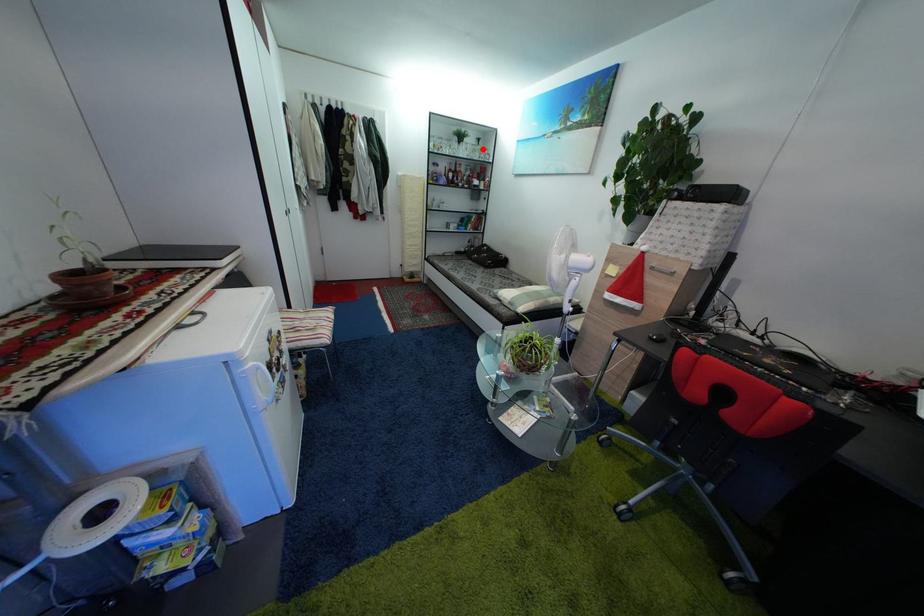
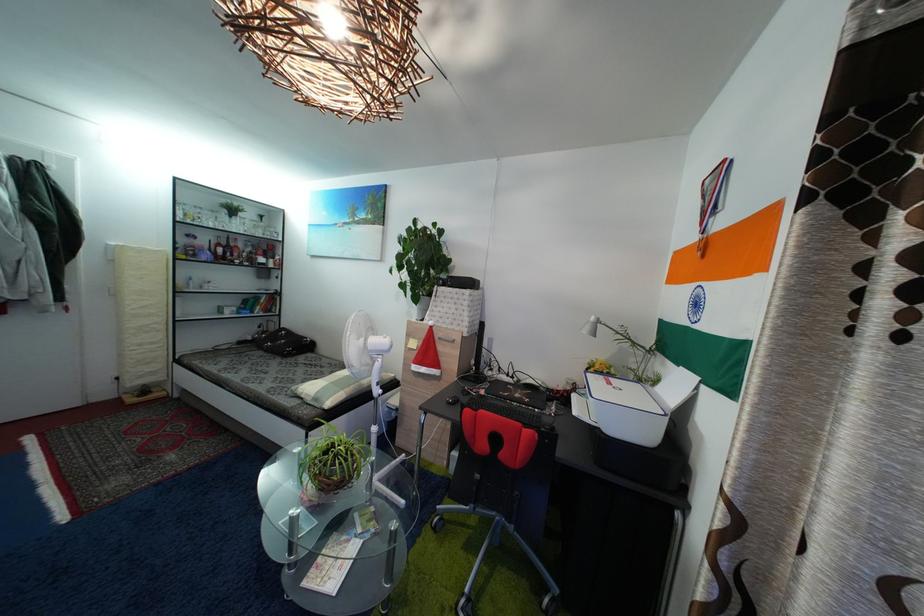
Question: A red point is marked in image1. In image2, is the corresponding 3D point closer to the camera or farther? Reply with the corresponding letter.

Choices:
 (A) The corresponding 3D point is closer.
 (B) The corresponding 3D point is farther.

Answer: (B)